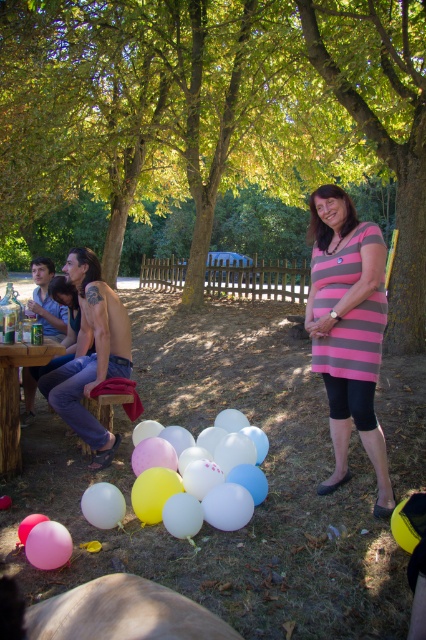
You are standing at the base of the green leafy tree at upper center. You want to throw a ball to a friend who is standing 15 feet away from you in the direction opposite the tree. Will the tree block the ball?

The green leafy tree at upper center is 20.50 feet from viewer. Since your friend is 15 feet away from you in the opposite direction, the tree is farther away than your friend, so the tree will not block the ball.

You are planning to hang a string of fairy lights between the green leafy tree at upper center and the pink rubber balloon at lower left. Considering their heights, will the balloon be visible below the fairy lights?

The green leafy tree at upper center is taller than the pink rubber balloon at lower left. Since the fairy lights would be hung between them, the balloon will be positioned below the lights and thus visible beneath them.

You are attending an outdoor event and notice a pink striped dress at center and a pink rubber balloon at lower left. Which object takes up more space in the image?

The pink striped dress at center takes up more space in the image because it has a larger size compared to the pink rubber balloon at lower left.